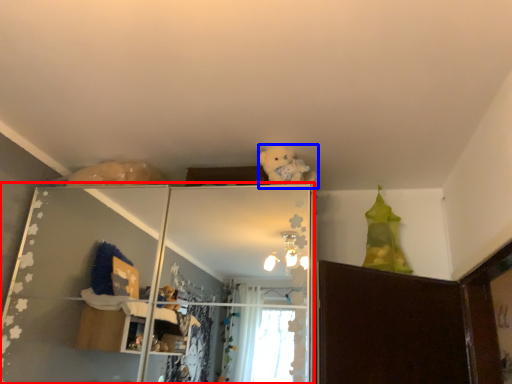
Question: Which object is closer to the camera taking this photo, shelf (highlighted by a red box) or teddy (highlighted by a blue box)?

Choices:
 (A) shelf
 (B) teddy

Answer: (A)